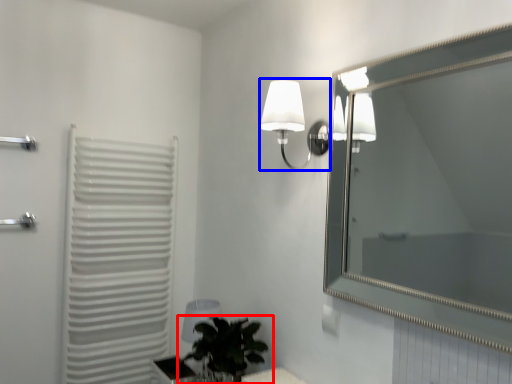
Question: Which object is closer to the camera taking this photo, houseplant (highlighted by a red box) or lamp (highlighted by a blue box)?

Choices:
 (A) houseplant
 (B) lamp

Answer: (B)